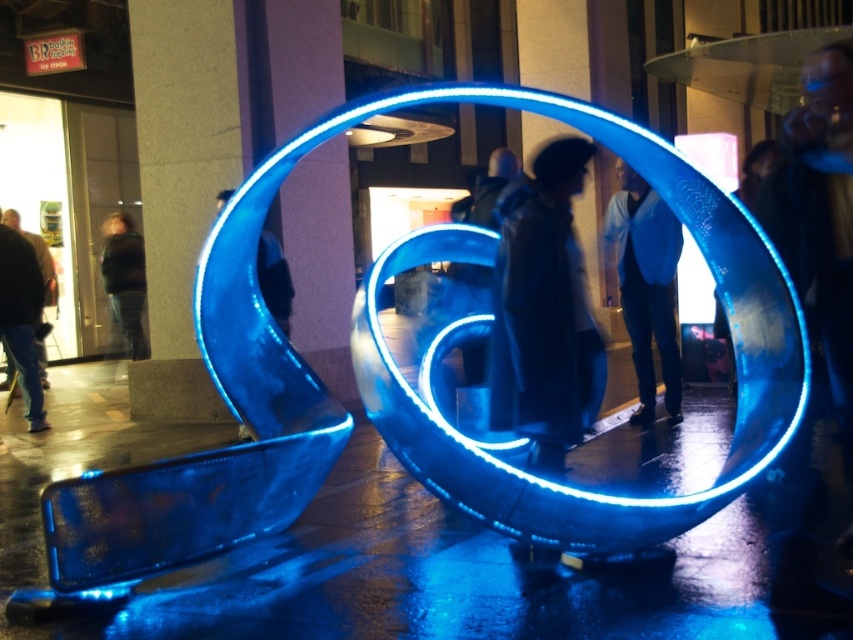
Can you confirm if blue glossy jacket at center is bigger than dark blue jeans at left?

Yes.

Between blue glossy jacket at center and dark blue jeans at left, which one has less height?

Standing shorter between the two is dark blue jeans at left.

Who is more forward, (645, 282) or (16, 301)?

Positioned in front is point (645, 282).

You are a GUI agent. You are given a task and a screenshot of the screen. Output one action in this format:
    pyautogui.click(x=<x>, y=<y>)
    Task: Click on the blue glossy jacket at center
    Image resolution: width=853 pixels, height=640 pixels.
    Given the screenshot: What is the action you would take?
    pyautogui.click(x=646, y=285)

Which is more to the left, dark blue jeans at left or dark green jacket at left?

From the viewer's perspective, dark green jacket at left appears more on the left side.

Which is in front, point (24, 259) or point (111, 221)?

Point (24, 259) is more forward.

Is point (47, 422) more distant than point (140, 301)?

That is False.

Identify the location of dark blue jeans at left. (21, 317).

Who is positioned more to the right, dark blue jeans at left or shiny blue ring at center?

Positioned to the right is shiny blue ring at center.

Is dark blue jeans at left bigger than shiny blue ring at center?

Indeed, dark blue jeans at left has a larger size compared to shiny blue ring at center.

Is point (15, 253) positioned in front of point (271, 292)?

No.

Locate an element on the screen. dark blue jeans at left is located at coordinates (21, 317).